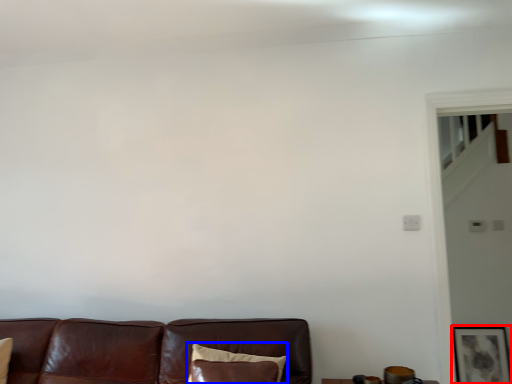
Question: Which object appears farthest to the camera in this image, picture frame (highlighted by a red box) or pillow (highlighted by a blue box)?

Choices:
 (A) picture frame
 (B) pillow

Answer: (A)